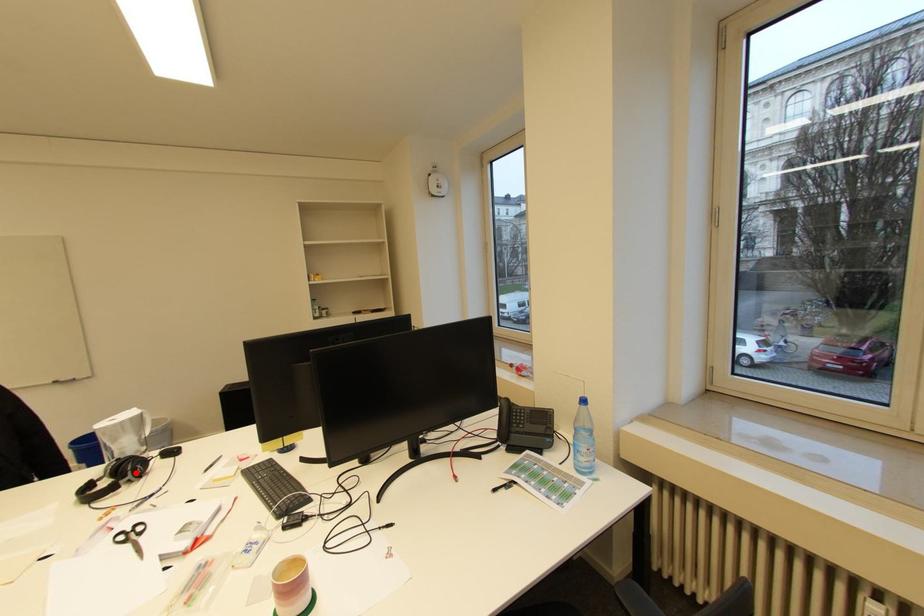
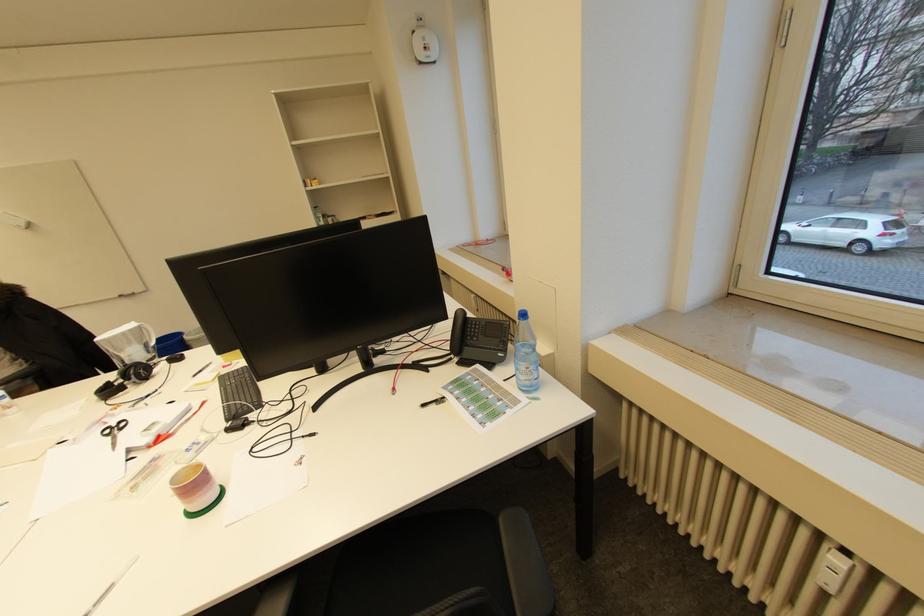
The point at the highlighted location is marked in the first image. Where is the corresponding point in the second image?

(140, 377)